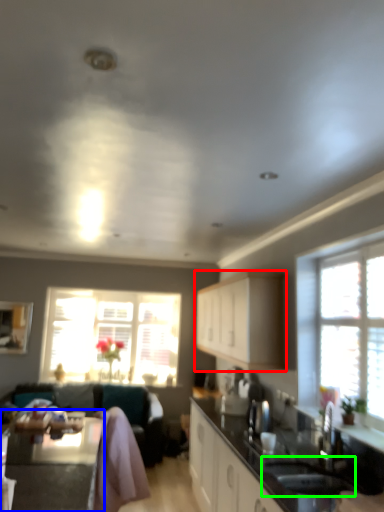
Question: Which object is positioned farthest from cabinetry (highlighted by a red box)? Select from table (highlighted by a blue box) and sink (highlighted by a green box).

Choices:
 (A) table
 (B) sink

Answer: (A)